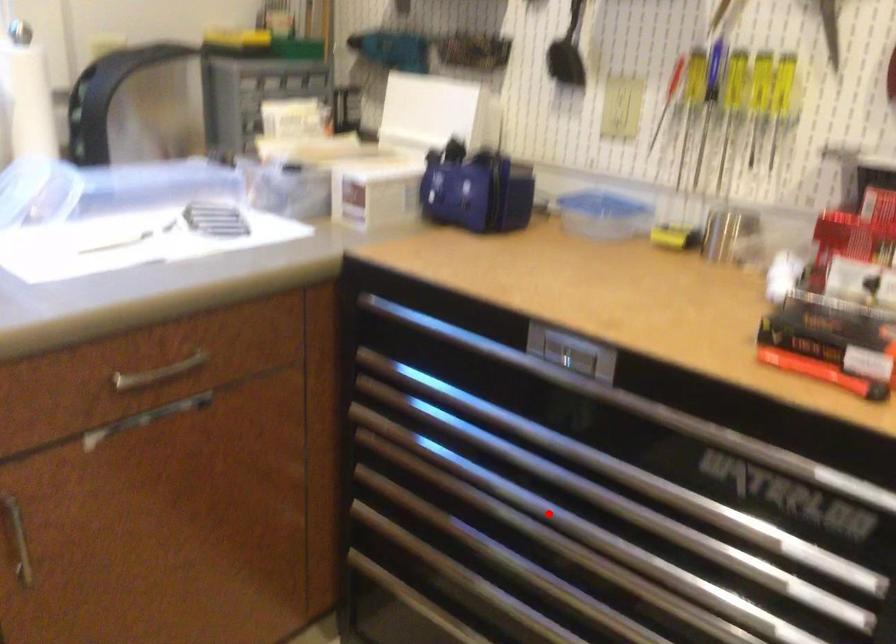
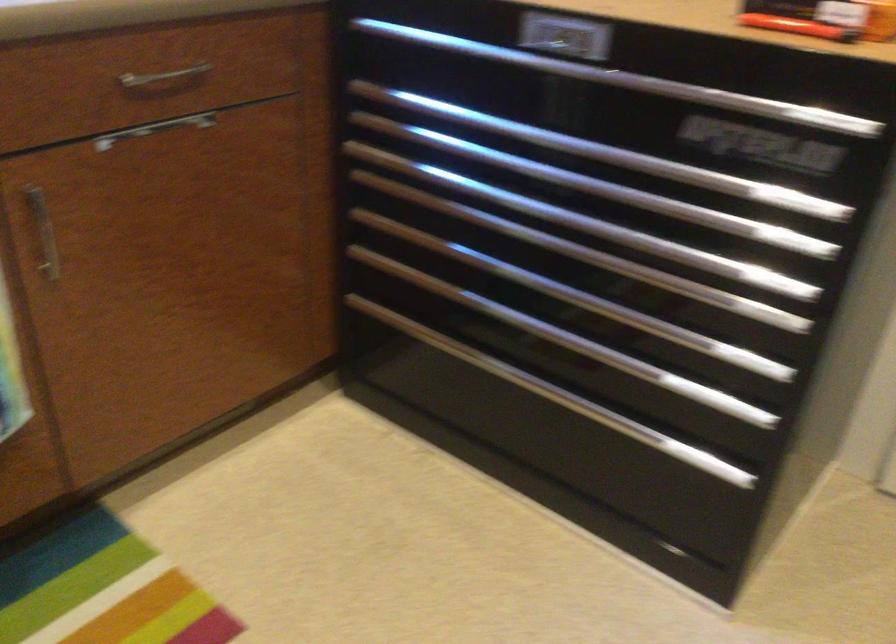
Find the pixel in the second image that matches the highlighted location in the first image.

(538, 209)